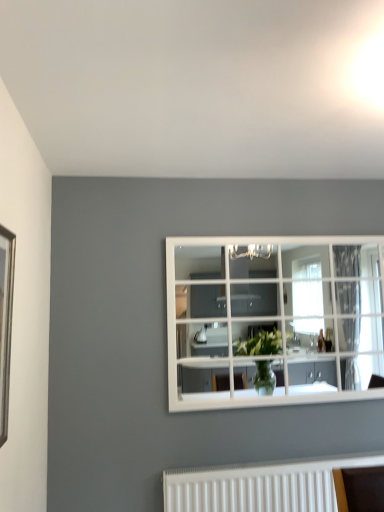
Image resolution: width=384 pixels, height=512 pixels. I want to click on wooden picture frame at left, so click(x=6, y=322).

Describe the element at coordinates (6, 322) in the screenshot. Image resolution: width=384 pixels, height=512 pixels. I see `wooden picture frame at left` at that location.

What is the approximate height of wooden picture frame at left?

29.19 inches.

Measure the distance between point (2, 288) and camera.

They are 1.46 meters apart.

This screenshot has height=512, width=384. Find the location of `wooden picture frame at left`. wooden picture frame at left is located at coordinates (6, 322).